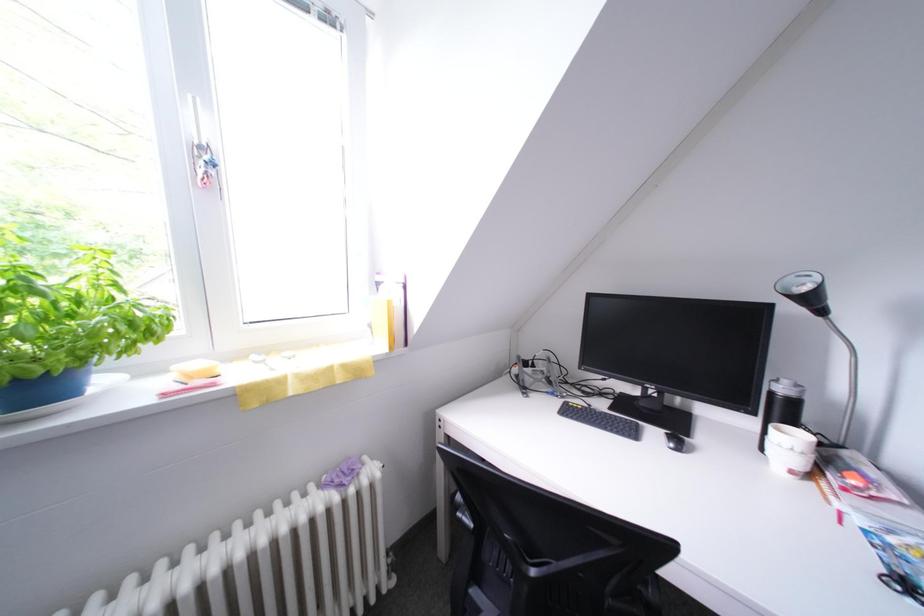
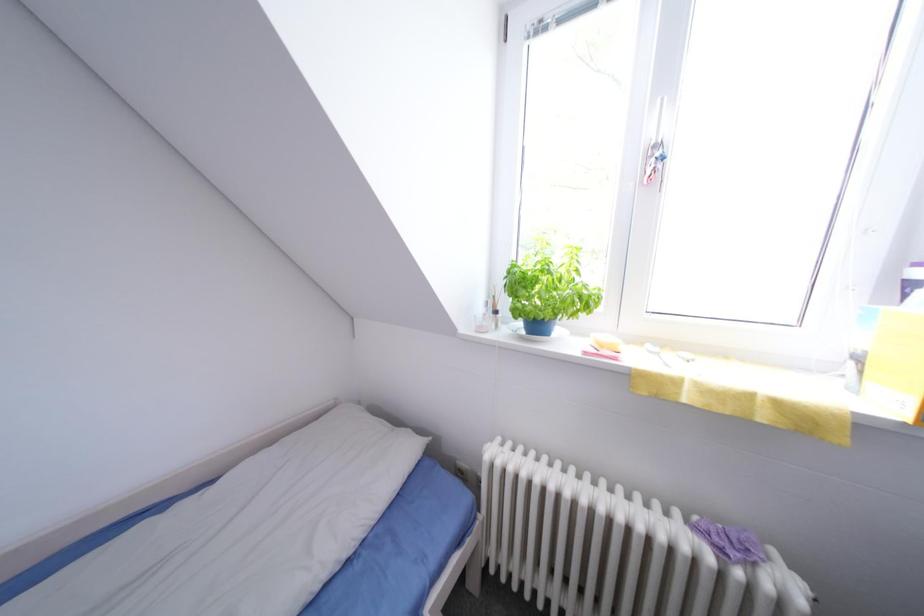
Question: The images are taken continuously from a first-person perspective. In which direction is your viewpoint rotating?

Choices:
 (A) Left
 (B) Right
 (C) Up
 (D) Down

Answer: (A)